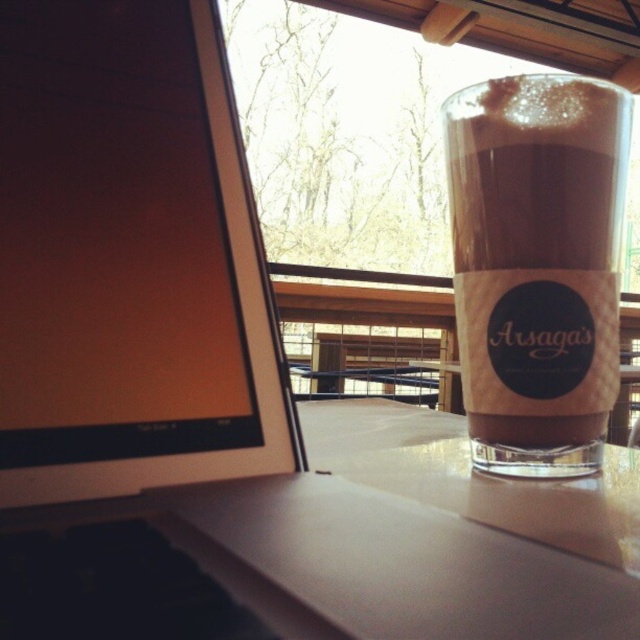
Who is higher up, matte black monitor at left or brown frothy beverage at right?

matte black monitor at left is above.

Does matte black monitor at left appear under brown frothy beverage at right?

Incorrect, matte black monitor at left is not positioned below brown frothy beverage at right.

The image size is (640, 640). I want to click on matte black monitor at left, so click(129, 259).

This screenshot has height=640, width=640. Identify the location of matte black monitor at left. (129, 259).